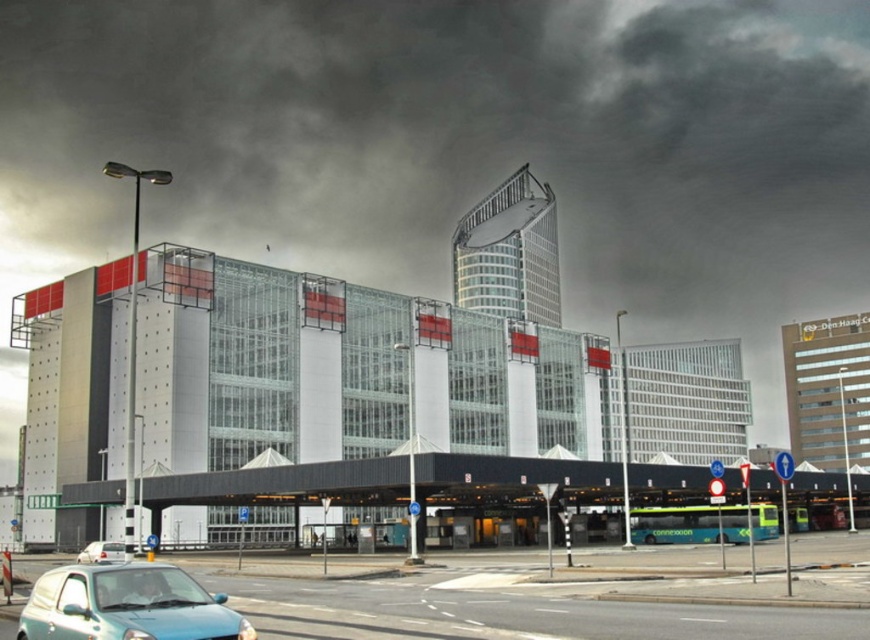
Question: Does teal matte car at lower left have a larger size compared to white matte van at lower left?

Choices:
 (A) no
 (B) yes

Answer: (B)

Question: Can you confirm if teal matte car at lower left is positioned to the left of white matte van at lower left?

Choices:
 (A) no
 (B) yes

Answer: (A)

Question: Which of the following is the farthest from the observer?

Choices:
 (A) (116, 560)
 (B) (154, 611)

Answer: (A)

Question: Among these points, which one is farthest from the camera?

Choices:
 (A) (114, 547)
 (B) (128, 580)

Answer: (A)

Question: Observing the image, what is the correct spatial positioning of teal matte car at lower left in reference to white matte van at lower left?

Choices:
 (A) above
 (B) below

Answer: (A)